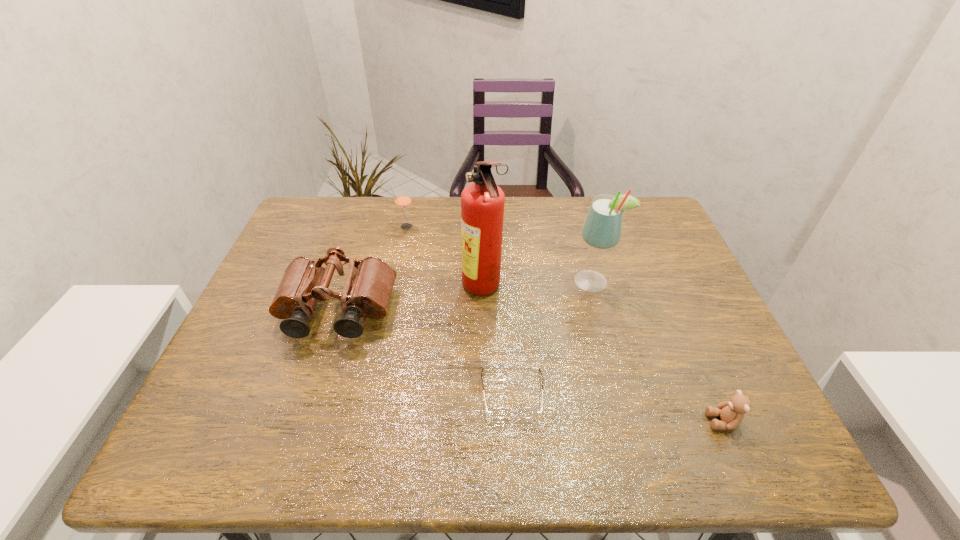
What are the coordinates of `free area in between the farthest object and the shortest object` in the screenshot? It's located at (459, 310).

The height and width of the screenshot is (540, 960). What are the coordinates of `vacant space that is in between the shortest object and the binoculars` in the screenshot? It's located at (425, 353).

Where is `vacant space that's between the spectacles and the second shortest object`? vacant space that's between the spectacles and the second shortest object is located at coordinates (617, 407).

Image resolution: width=960 pixels, height=540 pixels. In order to click on vacant region between the shortest object and the second shortest object in this screenshot , I will do `click(617, 407)`.

You are a GUI agent. You are given a task and a screenshot of the screen. Output one action in this format:
    pyautogui.click(x=<x>, y=<y>)
    Task: Click on the free space that is in between the rightmost object and the shortest object
    The width and height of the screenshot is (960, 540).
    Given the screenshot: What is the action you would take?
    pyautogui.click(x=617, y=407)

Find the location of a particular element. This screenshot has height=540, width=960. vacant point located between the binoculars and the fire extinguisher is located at coordinates (410, 300).

Locate an element on the screen. vacant space that is in between the shortest object and the fifth shortest object is located at coordinates (553, 338).

You are a GUI agent. You are given a task and a screenshot of the screen. Output one action in this format:
    pyautogui.click(x=<x>, y=<y>)
    Task: Click on the unoccupied area between the second tallest object and the tallest object
    Image resolution: width=960 pixels, height=540 pixels.
    Given the screenshot: What is the action you would take?
    pyautogui.click(x=538, y=286)

Find the location of `the closest object to the shortest object`. the closest object to the shortest object is located at coordinates (482, 203).

Locate which object ranks second in proximity to the straw. Please provide its 2D coordinates. Your answer should be formatted as a tuple, i.e. [(x, y)], where the tuple contains the x and y coordinates of a point satisfying the conditions above.

[(482, 203)]